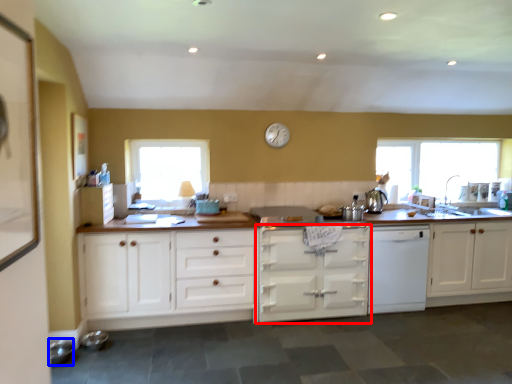
Question: Which object appears farthest to the camera in this image, cabinetry (highlighted by a red box) or appliance (highlighted by a blue box)?

Choices:
 (A) cabinetry
 (B) appliance

Answer: (A)